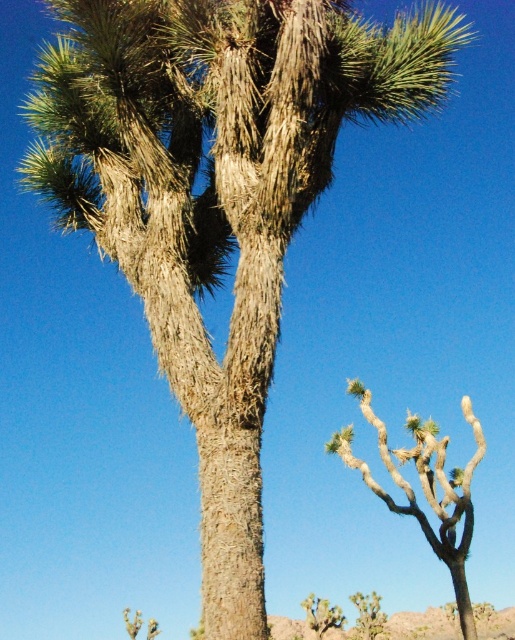
You are standing in the desert and see two points marked on the ground. The first point is at coordinates point (x=468, y=532), and the second point is at point (x=317, y=616). Which point is closer to you?

Point (x=468, y=532) is closer to the viewer than point (x=317, y=616).

You are a hiker who wants to take a photo of the green spiky plant at lower center and the green spiky cactus at lower right. To ensure both are in focus, you need to know which one is taller. Can you tell me which is taller?

The green spiky plant at lower center has a greater height compared to the green spiky cactus at lower right, so the green spiky plant at lower center is taller.